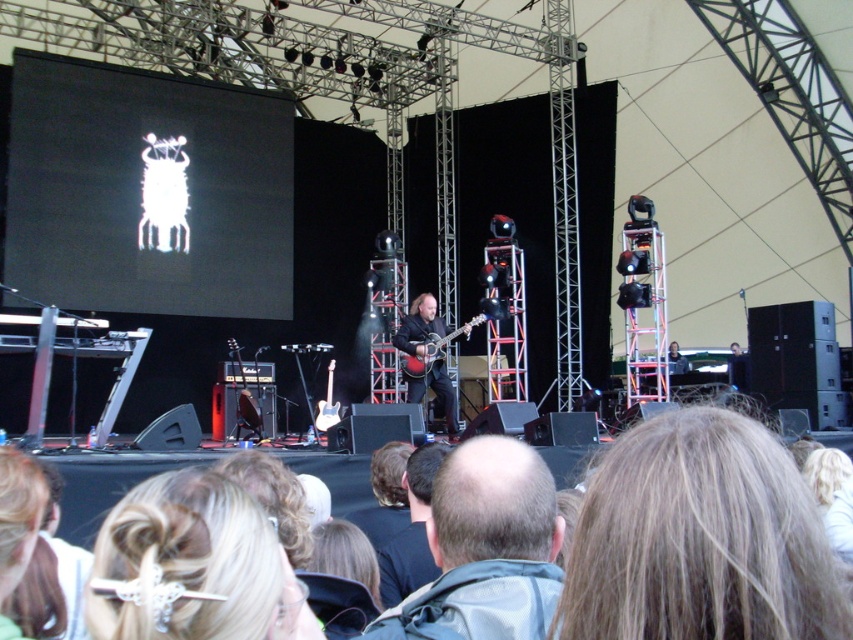
You are a photographer at the concert and need to capture a clear shot of both the dark brown leather jacket at center and the acoustic guitar at center. Since you can only focus on one subject at a time, which one should you focus on to ensure the other is still in the background?

You should focus on the dark brown leather jacket at center because it is in front of the acoustic guitar at center, so if you focus on the jacket, the guitar will naturally be in the background and still in view.

You are a photographer at the concert venue. You want to take a photo of the performer so that both the light brown hair at center and the dark brown leather jacket at center are visible. Based on their positions, which object should be placed more to the left in the frame?

The dark brown leather jacket at center should be placed more to the left in the frame because the light brown hair at center is positioned on the right side of it.

You are a photographer at the concert and want to capture the performer. Which object should you focus on first if you want to photograph the performer from the audience perspective? The light brown hair at center or the dark brown leather jacket at center?

The light brown hair at center is located above the dark brown leather jacket at center, so you should focus on the light brown hair at center first as it is positioned higher up on the performer.